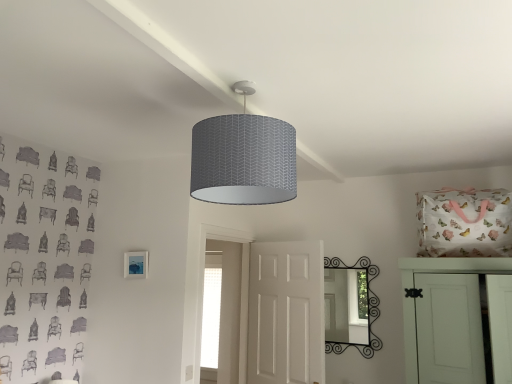
Question: Could you tell me if matte blue picture frame at lower left is turned towards white matte door at center, the first door when ordered from left to right?

Choices:
 (A) yes
 (B) no

Answer: (B)

Question: Is matte blue picture frame at lower left not inside white matte door at center, which ranks as the second door in right-to-left order?

Choices:
 (A) no
 (B) yes

Answer: (B)

Question: Is matte blue picture frame at lower left smaller than white matte door at center, which ranks as the second door in right-to-left order?

Choices:
 (A) yes
 (B) no

Answer: (A)

Question: From a real-world perspective, is matte blue picture frame at lower left under white matte door at center, which ranks as the second door in right-to-left order?

Choices:
 (A) no
 (B) yes

Answer: (A)

Question: Is matte blue picture frame at lower left positioned far away from white matte door at center, which ranks as the second door in right-to-left order?

Choices:
 (A) yes
 (B) no

Answer: (A)

Question: From the image's perspective, is matte blue picture frame at lower left on white matte door at center, the first door when ordered from left to right?

Choices:
 (A) yes
 (B) no

Answer: (A)

Question: Could you tell me if white matte door at center, which ranks as the second door in right-to-left order, is turned towards white matte cabinet door at right, placed as the second door when sorted from left to right?

Choices:
 (A) no
 (B) yes

Answer: (A)

Question: Is white matte door at center, which ranks as the second door in right-to-left order, looking in the opposite direction of white matte cabinet door at right, the 1th door viewed from the right?

Choices:
 (A) no
 (B) yes

Answer: (A)

Question: From the image's perspective, is white matte door at center, which ranks as the second door in right-to-left order, on top of white matte cabinet door at right, placed as the second door when sorted from left to right?

Choices:
 (A) no
 (B) yes

Answer: (A)

Question: Does white matte door at center, which ranks as the second door in right-to-left order, have a larger size compared to white matte cabinet door at right, placed as the second door when sorted from left to right?

Choices:
 (A) yes
 (B) no

Answer: (B)

Question: Is white matte cabinet door at right, the 1th door viewed from the right, a part of white matte door at center, the first door when ordered from left to right?

Choices:
 (A) yes
 (B) no

Answer: (B)

Question: Is white matte door at center, which ranks as the second door in right-to-left order, not inside white matte cabinet door at right, the 1th door viewed from the right?

Choices:
 (A) no
 (B) yes

Answer: (B)

Question: From a real-world perspective, is matte blue picture frame at lower left beneath black wrought iron mirror at center?

Choices:
 (A) yes
 (B) no

Answer: (B)